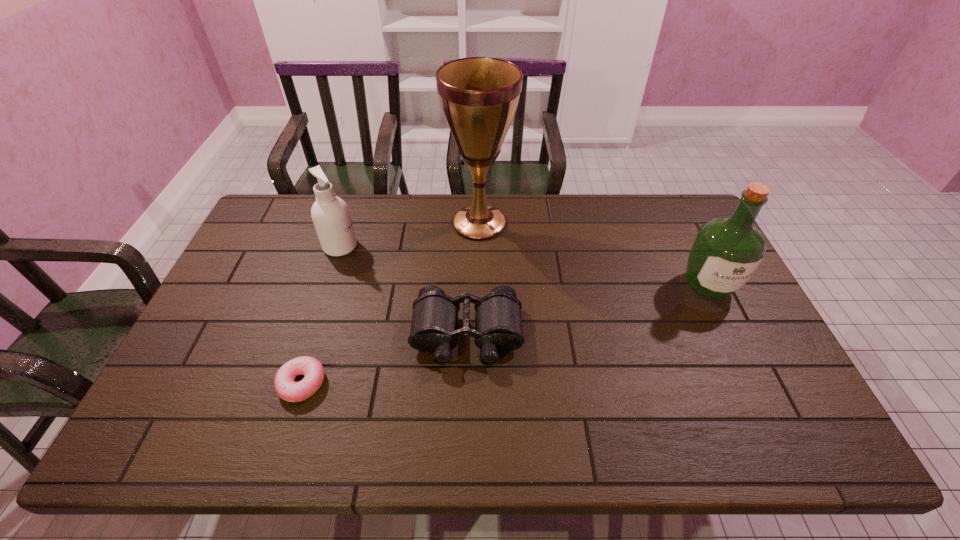
This screenshot has height=540, width=960. In order to click on the tallest object in this screenshot , I will do click(479, 96).

Image resolution: width=960 pixels, height=540 pixels. Find the location of `liquor`. liquor is located at coordinates (727, 251).

This screenshot has width=960, height=540. Find the location of `the second tallest object`. the second tallest object is located at coordinates (727, 251).

In order to click on cleansing agent in this screenshot , I will do `click(330, 214)`.

Identify the location of the fourth tallest object. (498, 326).

Locate an element on the screen. The image size is (960, 540). the shortest object is located at coordinates (312, 369).

You are a GUI agent. You are given a task and a screenshot of the screen. Output one action in this format:
    pyautogui.click(x=<x>, y=<y>)
    Task: Click on the vacant position located 0.230m on the left of the tallest object
    This screenshot has width=960, height=540.
    Given the screenshot: What is the action you would take?
    pyautogui.click(x=379, y=223)

This screenshot has width=960, height=540. In order to click on free region located on the front-facing side of the liquor in this screenshot , I will do `click(768, 408)`.

Locate an element on the screen. The width and height of the screenshot is (960, 540). free space located on the front label of the third shortest object is located at coordinates (x=473, y=246).

What are the coordinates of `free region located 0.080m through the eyepieces of the binoculars` in the screenshot? It's located at (466, 399).